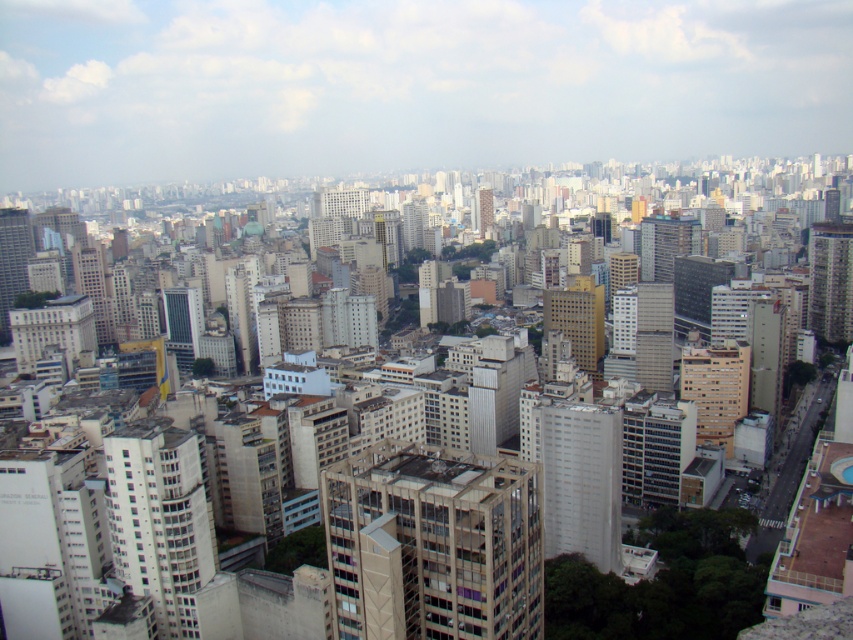
Looking at this image, you are standing at the top of a tall building in the city and looking down at the two points marked in the scene. Which point, point [548,316] or point [9,209], is closer to you?

Point [548,316] is closer to you than point [9,209].

You are an urban planner evaluating the cityscape. You need to determine which building is shorter between the gold metallic building at center and the matte glass skyscraper at left. Which one is shorter?

The gold metallic building at center is shorter than the matte glass skyscraper at left.

You are a city planner assessing the urban layout. The white concrete building at lower left and the smooth gray building at right are both candidates for a new public park. Given their distance apart, do you think it would be feasible to place a park between them that is 1,000 feet long?

The distance between the white concrete building at lower left and the smooth gray building at right is 953.27 feet, which is slightly shorter than the required 1,000 feet. Therefore, a park of that length would not fit between them.